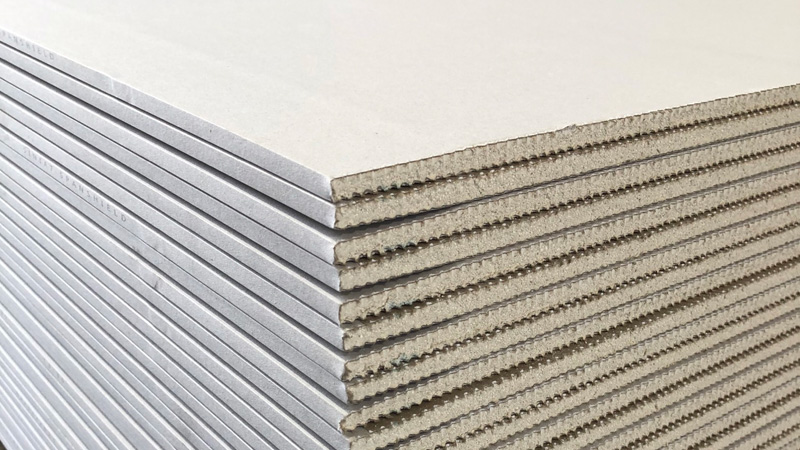
The image size is (800, 450). I want to click on sheet #3, so click(x=221, y=188).